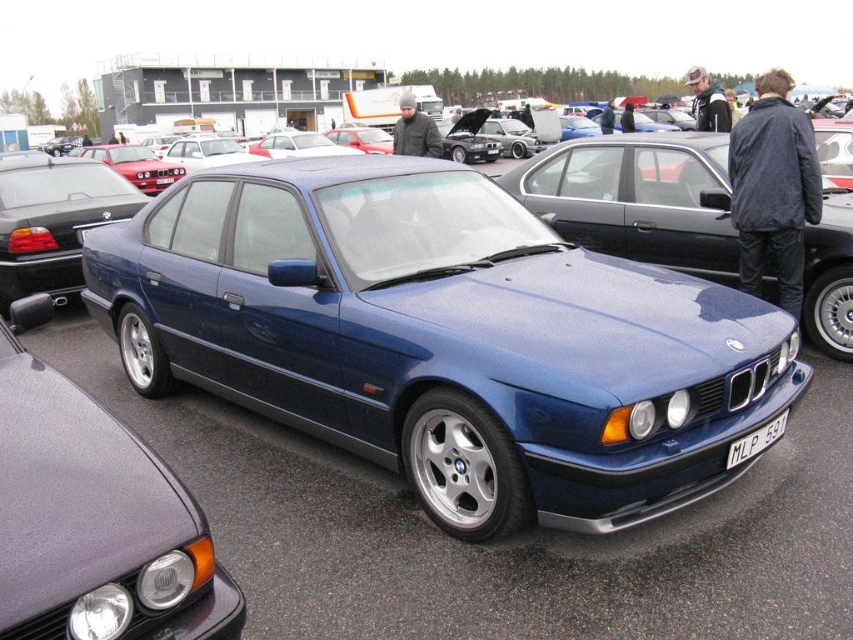
Question: Is metallic blue sedan at center positioned behind satin blue sedan at center?

Choices:
 (A) no
 (B) yes

Answer: (A)

Question: Which object appears farthest from the camera in this image?

Choices:
 (A) metallic blue sedan at center
 (B) satin blue sedan at center
 (C) satin blue car at center

Answer: (B)

Question: Among these points, which one is farthest from the camera?

Choices:
 (A) (0, 161)
 (B) (57, 602)
 (C) (730, 458)
 (D) (720, 198)

Answer: (A)

Question: Can you confirm if metallic blue sedan at center is positioned to the right of satin blue sedan at center?

Choices:
 (A) no
 (B) yes

Answer: (B)

Question: Among these objects, which one is farthest from the camera?

Choices:
 (A) satin blue sedan at center
 (B) white plastic license plate at lower center
 (C) satin blue car at center
 (D) metallic blue sedan at center

Answer: (A)

Question: Is the position of satin blue car at center less distant than that of white plastic license plate at lower center?

Choices:
 (A) yes
 (B) no

Answer: (B)